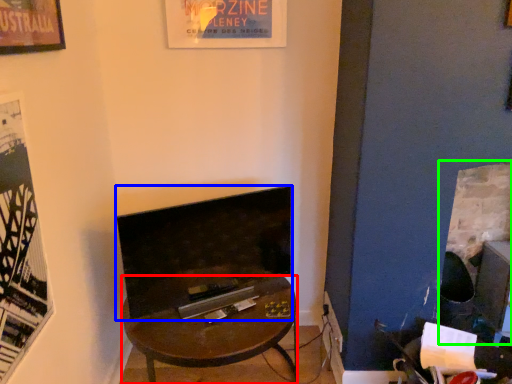
Question: Estimate the real-world distances between objects in this image. Which object is closer to desk (highlighted by a red box), fireplace (highlighted by a blue box) or fireplace (highlighted by a green box)?

Choices:
 (A) fireplace
 (B) fireplace

Answer: (A)